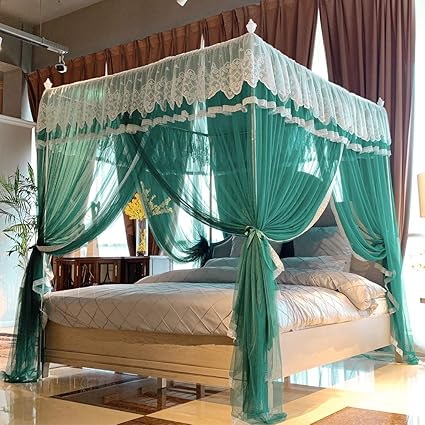
Locate an element on the screen. sheets is located at coordinates (209, 314).